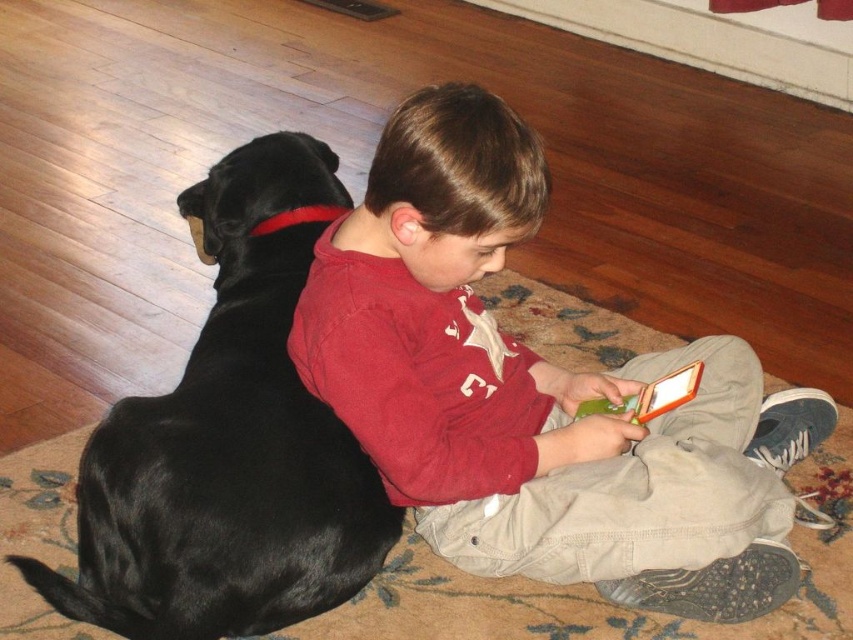
Question: Which object is farther from the camera taking this photo?

Choices:
 (A) black shiny fur at left
 (B) matte red shirt at center

Answer: (A)

Question: Does matte red shirt at center appear over black shiny fur at left?

Choices:
 (A) no
 (B) yes

Answer: (A)

Question: Can you confirm if matte red shirt at center is positioned below black shiny fur at left?

Choices:
 (A) no
 (B) yes

Answer: (B)

Question: Is matte red shirt at center in front of black shiny fur at left?

Choices:
 (A) no
 (B) yes

Answer: (B)

Question: Which object is closer to the camera taking this photo?

Choices:
 (A) black shiny fur at left
 (B) matte red shirt at center

Answer: (B)

Question: Among these points, which one is nearest to the camera?

Choices:
 (A) (279, 221)
 (B) (666, 438)

Answer: (B)